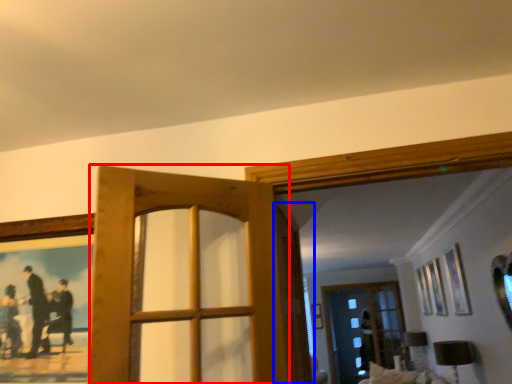
Question: Which object appears farthest to the camera in this image, door (highlighted by a red box) or screen door (highlighted by a blue box)?

Choices:
 (A) door
 (B) screen door

Answer: (B)